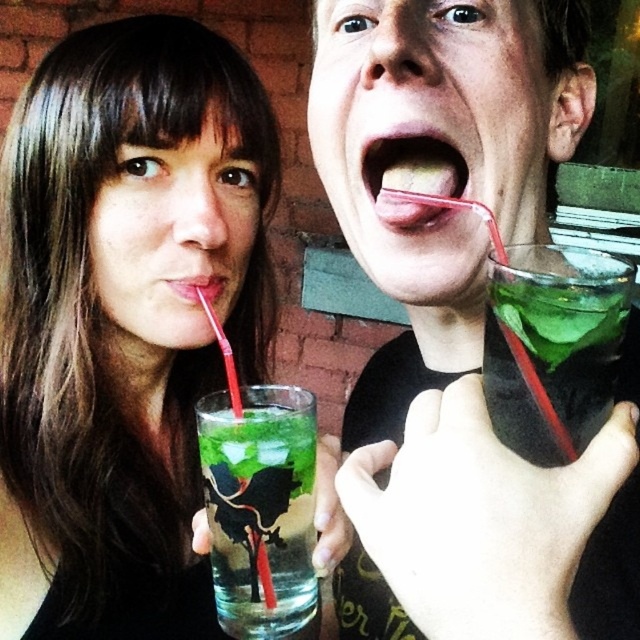
Question: Which is nearer to the green matte tongue at center?

Choices:
 (A) green translucent glass at mouth
 (B) green translucent liquid at right
 (C) green translucent glass at center
 (D) matte pink lips at center

Answer: (A)

Question: Does green translucent glass at mouth appear on the right side of green matte tongue at center?

Choices:
 (A) yes
 (B) no

Answer: (A)

Question: Based on their relative distances, which object is farther from the green translucent liquid at right?

Choices:
 (A) green translucent glass at center
 (B) matte pink lips at center
 (C) green matte tongue at center
 (D) green translucent glass at mouth

Answer: (B)

Question: Considering the relative positions of green translucent glass at center and matte pink lips at center in the image provided, where is green translucent glass at center located with respect to matte pink lips at center?

Choices:
 (A) left
 (B) right

Answer: (B)

Question: Does green translucent liquid at right have a smaller size compared to green matte tongue at center?

Choices:
 (A) no
 (B) yes

Answer: (A)

Question: Which object is positioned farthest from the green translucent glass at center?

Choices:
 (A) green translucent glass at mouth
 (B) green translucent liquid at right
 (C) green matte tongue at center
 (D) matte pink lips at center

Answer: (D)